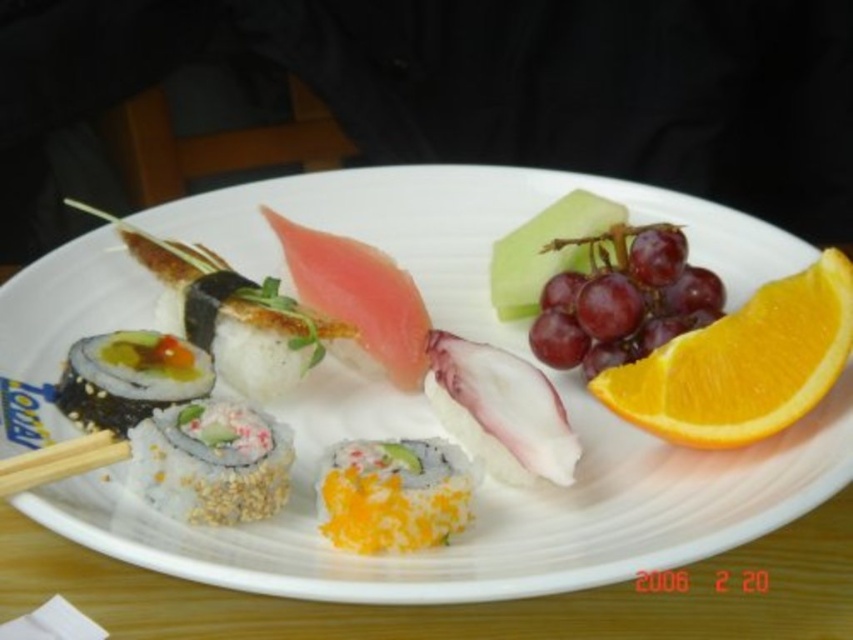
You have a small container that can only hold items smaller than the pink raw fish at center. Can you safely place the white glossy plate at center into the container?

The white glossy plate at center is larger than the pink raw fish at center, so it cannot fit into the container designed for items smaller than the pink raw fish at center.

You are a diner who wants to pick up the pink raw fish at center using the wooden chopsticks at lower left. Can you reach the fish with the chopsticks?

The pink raw fish at center is further to the viewer than wooden chopsticks at lower left, so the chopsticks are closer to you than the fish. This means the chopsticks are positioned behind the fish from your perspective, making it difficult to reach the fish properly with them.